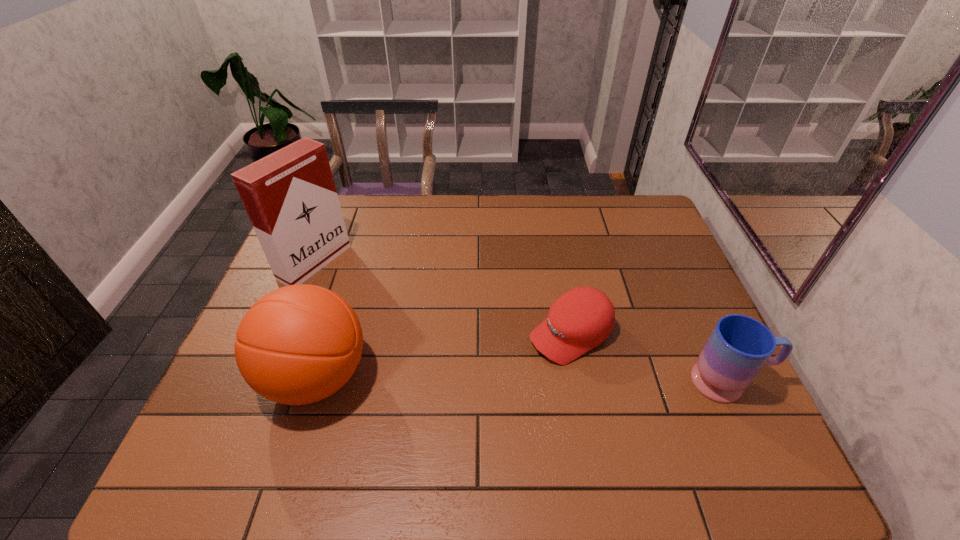
Where is `free space on the desktop that is between the basketball and the third tallest object and is positioned on the front-facing side of the third object from left to right`? This screenshot has height=540, width=960. free space on the desktop that is between the basketball and the third tallest object and is positioned on the front-facing side of the third object from left to right is located at coordinates (496, 379).

The width and height of the screenshot is (960, 540). What are the coordinates of `vacant space on the desktop that is between the second tallest object and the mug and is positioned on the front-facing side of the tallest object` in the screenshot? It's located at (540, 380).